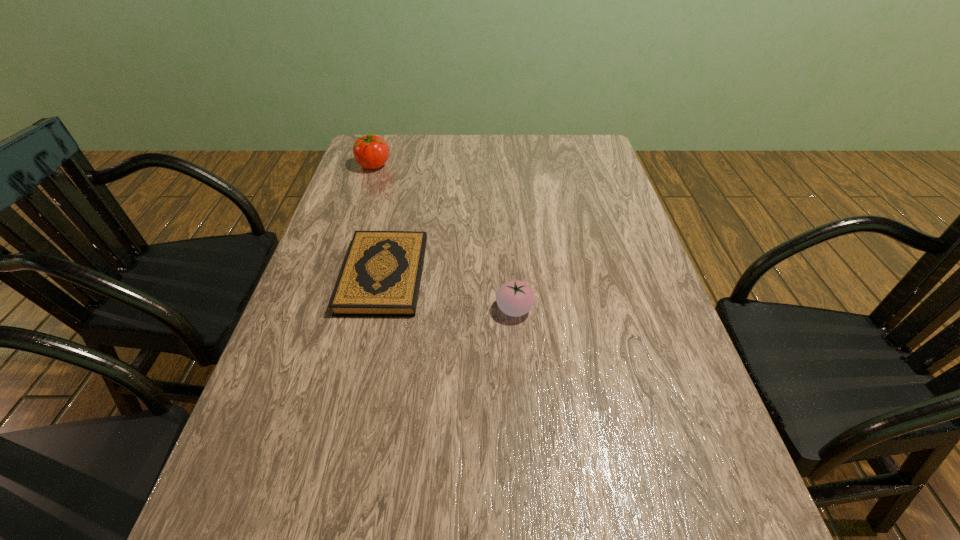
Locate an element on the screen. hardback book at the left edge is located at coordinates (381, 275).

You are a GUI agent. You are given a task and a screenshot of the screen. Output one action in this format:
    pyautogui.click(x=<x>, y=<y>)
    Task: Click on the object situated at the far left corner
    Image resolution: width=960 pixels, height=540 pixels.
    Given the screenshot: What is the action you would take?
    pyautogui.click(x=371, y=151)

Where is `vacant area at the left edge of the desktop`? The image size is (960, 540). vacant area at the left edge of the desktop is located at coordinates (281, 514).

Image resolution: width=960 pixels, height=540 pixels. In the image, there is a desktop. Identify the location of blank space at the right edge. (583, 192).

Find the location of a particular element. free spot at the far left corner of the desktop is located at coordinates (380, 167).

At what (x,y) coordinates should I click in order to perform the action: click on free area in between the right tomato and the hardback book. Please return your answer as a coordinate pair (x, y). This screenshot has width=960, height=540. Looking at the image, I should click on (449, 292).

I want to click on empty space that is in between the hardback book and the taller tomato, so click(379, 221).

You are a GUI agent. You are given a task and a screenshot of the screen. Output one action in this format:
    pyautogui.click(x=<x>, y=<y>)
    Task: Click on the vacant area between the nearer tomato and the taller tomato
    The height and width of the screenshot is (540, 960).
    Given the screenshot: What is the action you would take?
    pyautogui.click(x=444, y=238)

The width and height of the screenshot is (960, 540). I want to click on vacant area that lies between the left tomato and the hardback book, so click(379, 221).

The width and height of the screenshot is (960, 540). In order to click on vacant space that is in between the second shortest object and the farther tomato in this screenshot , I will do `click(444, 238)`.